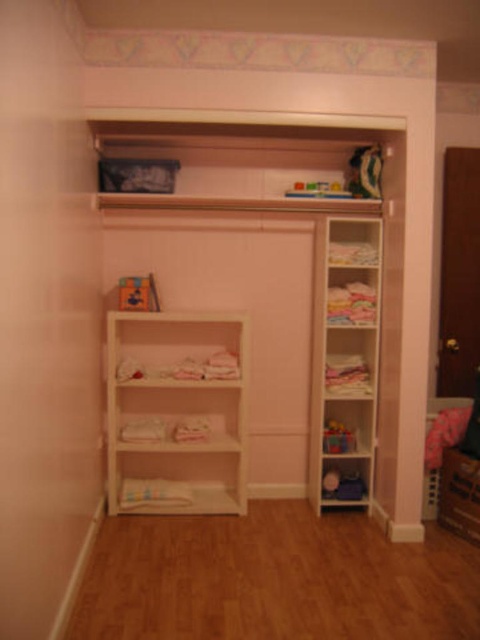
You are organizing a closet and need to place a new item on the white wood shelves at right. Where exactly should you place it?

You should place the new item at point (344, 362) on the white wood shelves at right.

You are standing in front of the closet and want to reach both the point at coordinates point (356, 468) and the point at coordinates point (367, 157). Which point will you reach first?

You will reach point (356, 468) first because it is closer to you than point (367, 157), which is further away.

You are standing in the closet and want to place a new bookshelf exactly at the center of the closet. Is the white matte bookshelf at center already occupying that spot?

The white matte bookshelf at center is positioned at point (176, 412), which is not the exact center of the closet. Therefore, it is not occupying the center spot.